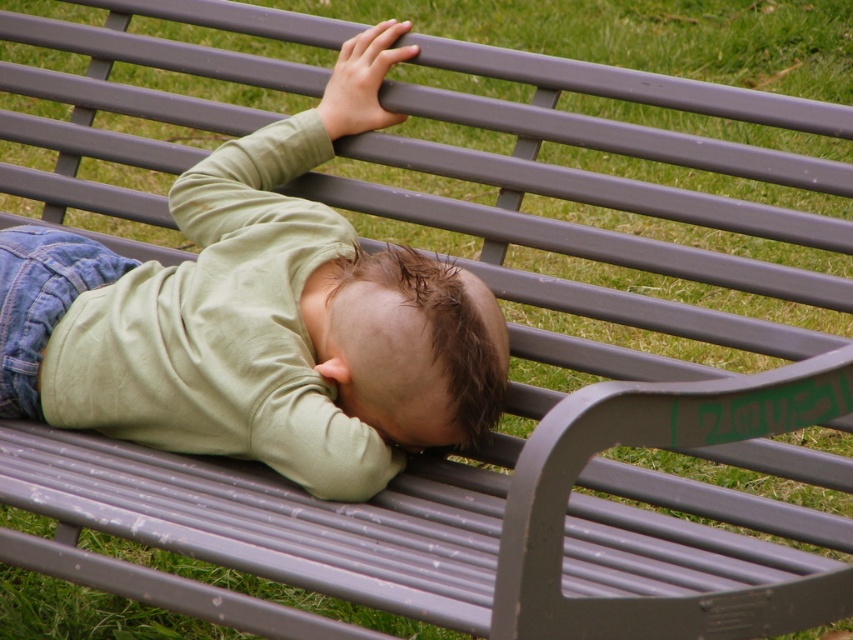
You are a drone operator trying to capture aerial footage of the park. You have two points marked on your map, point (320, 257) and point (486, 362). If you want to fly the drone from the point that is closer to the camera, which point should you choose?

Point (320, 257) is behind point (486, 362), so the closer point to the camera is point (486, 362). You should choose point (486, 362) to fly the drone from the point closer to the camera.

You are a photographer trying to capture the exact position of the matte green shirt at center in the scene. What are the coordinates where you should focus your camera?

The coordinates for the matte green shirt at center are at point (259,317).

You are a photographer trying to capture the child in the image. You want to ensure that both the matte green shirt at center and the brown matte hair at center are clearly visible in your photo. Based on their sizes, which object should you focus on first to ensure clarity?

The matte green shirt at center has a greater height compared to the brown matte hair at center, so focusing on the matte green shirt at center first will ensure clarity since it is larger and more prominent.